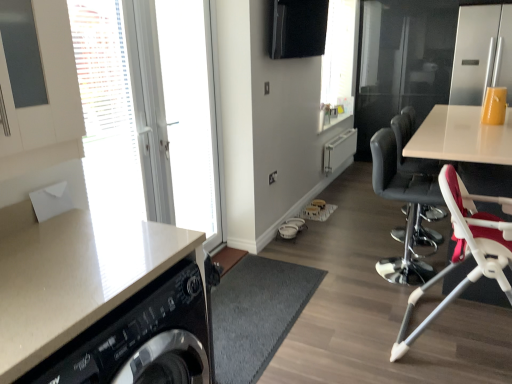
Question: Considering the relative sizes of transparent glass window screen at upper center, the 1th window screen when ordered from right to left, and white glossy countertop at lower left in the image provided, is transparent glass window screen at upper center, the 1th window screen when ordered from right to left, thinner than white glossy countertop at lower left?

Choices:
 (A) yes
 (B) no

Answer: (A)

Question: Is transparent glass window screen at upper center, the 1th window screen when ordered from right to left, wider than white glossy countertop at lower left?

Choices:
 (A) no
 (B) yes

Answer: (A)

Question: Can you confirm if transparent glass window screen at upper center, which appears as the first window screen when viewed from the back, is bigger than white glossy countertop at lower left?

Choices:
 (A) yes
 (B) no

Answer: (A)

Question: Is transparent glass window screen at upper center, the 1th window screen when ordered from right to left, far from white glossy countertop at lower left?

Choices:
 (A) yes
 (B) no

Answer: (A)

Question: Considering the relative positions of transparent glass window screen at upper center, which appears as the first window screen when viewed from the back, and white glossy countertop at lower left in the image provided, is transparent glass window screen at upper center, which appears as the first window screen when viewed from the back, behind white glossy countertop at lower left?

Choices:
 (A) yes
 (B) no

Answer: (A)

Question: In the image, is white plastic high chair at right positioned in front of or behind red fabric high chair at right, positioned as the second chair in back-to-front order?

Choices:
 (A) front
 (B) behind

Answer: (B)

Question: From a real-world perspective, is white plastic high chair at right positioned above or below red fabric high chair at right, arranged as the first chair when viewed from the front?

Choices:
 (A) above
 (B) below

Answer: (A)

Question: Would you say white plastic high chair at right is to the left or to the right of red fabric high chair at right, arranged as the first chair when viewed from the front, in the picture?

Choices:
 (A) right
 (B) left

Answer: (A)

Question: Is white plastic high chair at right spatially inside red fabric high chair at right, positioned as the second chair in back-to-front order, or outside of it?

Choices:
 (A) inside
 (B) outside

Answer: (B)

Question: From the image's perspective, is transparent glass window screen at upper center, which appears as the first window screen when viewed from the back, above or below white glossy door at left, which is counted as the first window, starting from the back?

Choices:
 (A) above
 (B) below

Answer: (A)

Question: From a real-world perspective, is transparent glass window screen at upper center, the second window screen in the left-to-right sequence, physically located above or below white glossy door at left, the 2th window from the front?

Choices:
 (A) below
 (B) above

Answer: (B)

Question: Relative to white glossy door at left, the 2th window from the front, is transparent glass window screen at upper center, the 1th window screen when ordered from right to left, in front or behind?

Choices:
 (A) behind
 (B) front

Answer: (A)

Question: Is transparent glass window screen at upper center, the 1th window screen when ordered from right to left, bigger or smaller than white glossy door at left, which is counted as the first window, starting from the back?

Choices:
 (A) big
 (B) small

Answer: (A)

Question: Is white glossy door at left, which ranks as the second window in back-to-front order, wider or thinner than white glass door at left, which is counted as the second window screen, starting from the right?

Choices:
 (A) wide
 (B) thin

Answer: (A)

Question: Considering the relative positions of white glossy door at left, which ranks as the second window in back-to-front order, and white glass door at left, the 1th window screen positioned from the left, in the image provided, is white glossy door at left, which ranks as the second window in back-to-front order, to the left or to the right of white glass door at left, the 1th window screen positioned from the left,?

Choices:
 (A) right
 (B) left

Answer: (B)